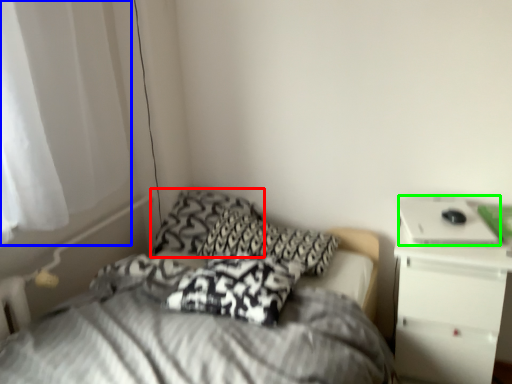
Question: Based on their relative distances, which object is nearer to pillow (highlighted by a red box)? Choose from curtain (highlighted by a blue box) and laptop (highlighted by a green box).

Choices:
 (A) curtain
 (B) laptop

Answer: (A)